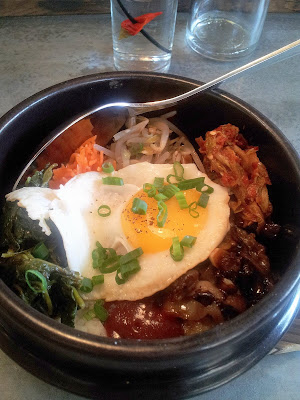
Find the location of a particular element. grey colored countertop is located at coordinates (276, 94).